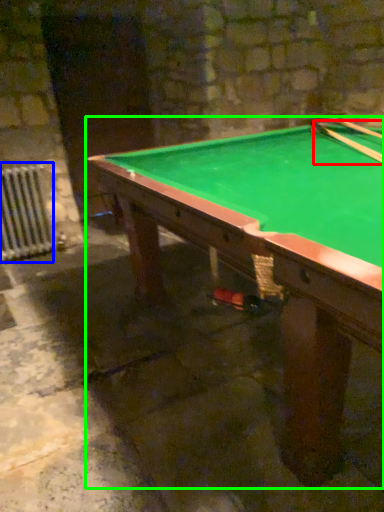
Question: Based on their relative distances, which object is nearer to cue (highlighted by a red box)? Choose from radiator (highlighted by a blue box) and billiard table (highlighted by a green box).

Choices:
 (A) radiator
 (B) billiard table

Answer: (B)